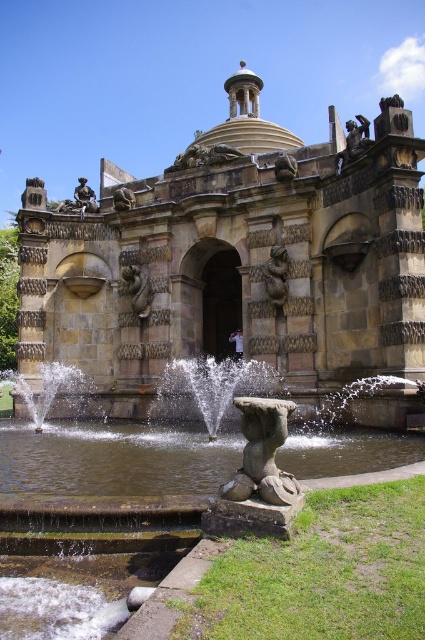
Is brown stone palace at center thinner than sandy stone statue at upper left?

In fact, brown stone palace at center might be wider than sandy stone statue at upper left.

Can you confirm if brown stone palace at center is smaller than sandy stone statue at upper left?

No.

Is point (78, 312) farther from camera compared to point (118, 193)?

Yes, it is behind point (118, 193).

This screenshot has height=640, width=425. Identify the location of brown stone palace at center. (232, 260).

Between point (323, 268) and point (283, 278), which one is positioned in front?

Positioned in front is point (323, 268).

Does brown stone palace at center have a smaller size compared to brown stone statue at center?

No.

This screenshot has width=425, height=640. What are the coordinates of `brown stone palace at center` in the screenshot? It's located at (232, 260).

Does green mossy stone fountain at lower left have a greater height compared to bronze statue at upper right?

Yes, green mossy stone fountain at lower left is taller than bronze statue at upper right.

Is green mossy stone fountain at lower left to the right of bronze statue at upper right from the viewer's perspective?

In fact, green mossy stone fountain at lower left is to the left of bronze statue at upper right.

Is point (379, 452) closer to viewer compared to point (365, 147)?

That is True.

Identify the location of green mossy stone fountain at lower left. Image resolution: width=425 pixels, height=640 pixels. (110, 458).